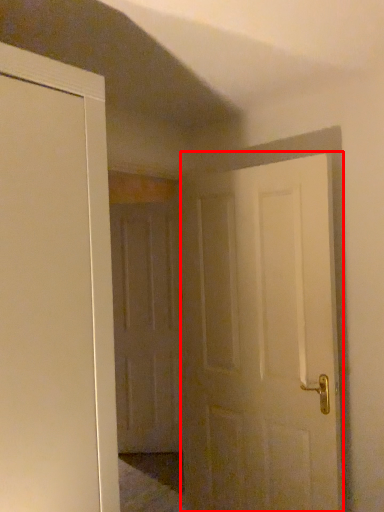
Question: Considering the relative positions of door (annotated by the red box) and door in the image provided, where is door (annotated by the red box) located with respect to the staircase?

Choices:
 (A) left
 (B) right

Answer: (B)